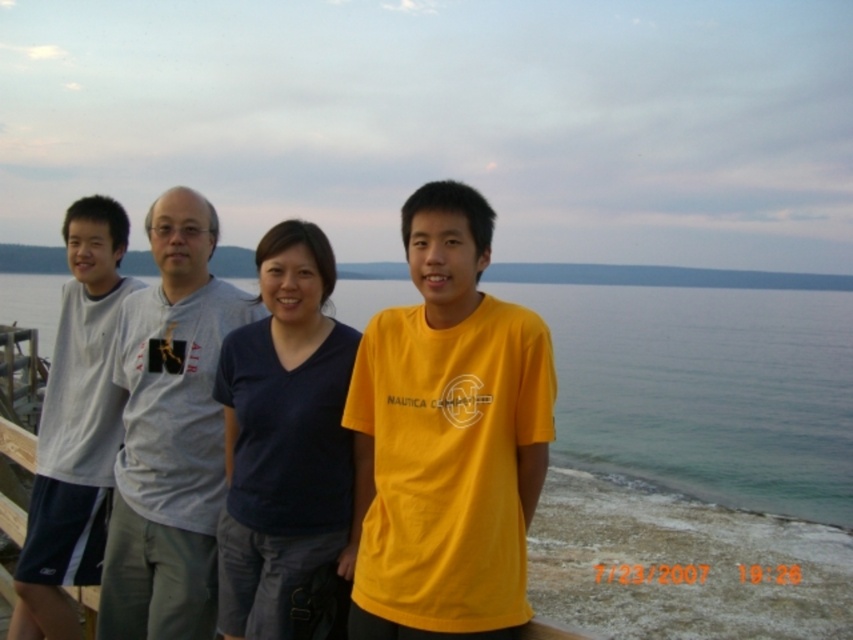
Question: Is dark blue fabric shirt at center below yellow matte shirt at center?

Choices:
 (A) no
 (B) yes

Answer: (B)

Question: Which of the following is the farthest from the observer?

Choices:
 (A) white matte t-shirt at left
 (B) dark blue fabric shirt at center
 (C) gray cotton t-shirt at center
 (D) yellow cotton t-shirt at center

Answer: (A)

Question: Does clear blue water at lower center appear on the right side of gray cotton t-shirt at center?

Choices:
 (A) no
 (B) yes

Answer: (B)

Question: Which of the following is the closest to the observer?

Choices:
 (A) yellow matte shirt at center
 (B) dark blue fabric shirt at center
 (C) yellow cotton t-shirt at center
 (D) clear blue water at lower center

Answer: (C)

Question: Which point appears closest to the camera in this image?

Choices:
 (A) (302, 314)
 (B) (274, 627)

Answer: (B)

Question: From the image, what is the correct spatial relationship of yellow cotton t-shirt at center in relation to dark blue fabric shirt at center?

Choices:
 (A) below
 (B) above

Answer: (B)